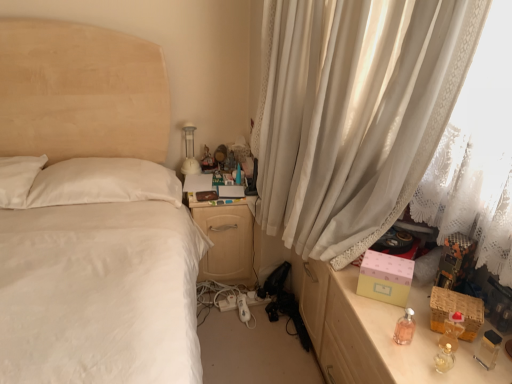
Where is `free space to the left of translucent amber bottle at right, the 2th perfume in the left-to-right sequence`? free space to the left of translucent amber bottle at right, the 2th perfume in the left-to-right sequence is located at coordinates (397, 338).